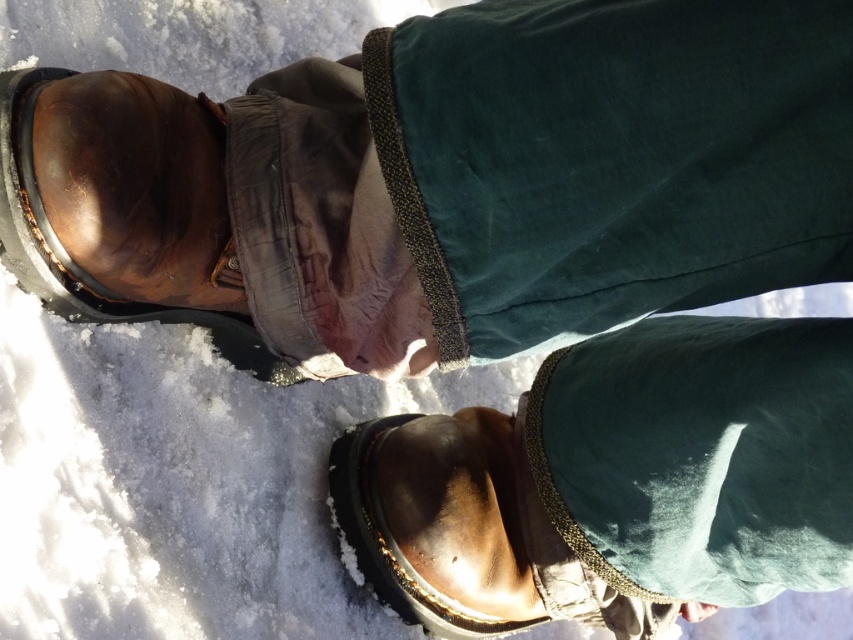
Question: Which point is closer to the camera taking this photo?

Choices:
 (A) (491, 625)
 (B) (184, 310)

Answer: (B)

Question: Does brown leather boot at left appear on the left side of shiny brown leather boot at lower center?

Choices:
 (A) no
 (B) yes

Answer: (B)

Question: Is brown leather boot at left bigger than shiny brown leather boot at lower center?

Choices:
 (A) yes
 (B) no

Answer: (A)

Question: Does brown leather boot at left have a larger size compared to shiny brown leather boot at lower center?

Choices:
 (A) no
 (B) yes

Answer: (B)

Question: Which point is closer to the camera taking this photo?

Choices:
 (A) (347, 490)
 (B) (254, 342)

Answer: (B)